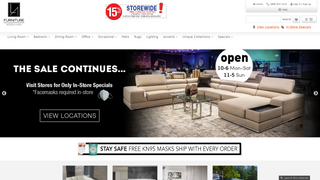
This screenshot has height=180, width=320. In order to click on tops of 4 photos in this screenshot , I will do `click(77, 175)`, `click(135, 177)`, `click(179, 176)`, `click(236, 172)`.